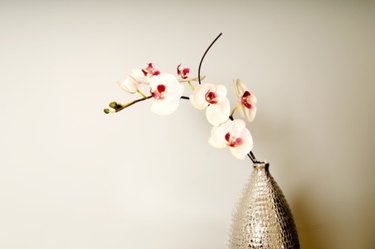
Where is `vase`? This screenshot has width=375, height=249. vase is located at coordinates (270, 210).